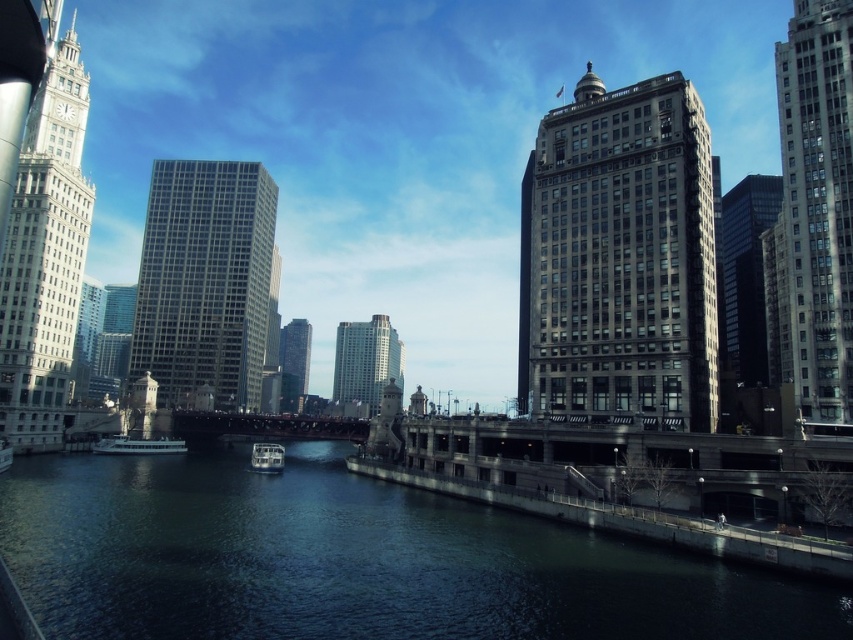
Based on the scene description, where is the white glass skyscraper at left located in the image?

The white glass skyscraper at left is located at point 0.402 on the x axis and 0.053 on the y axis.

You are a photographer standing on the bridge and want to capture both the smooth glass skyscraper at center and the white glossy boat at center in a single shot. Based on their positions, which object should you frame first to ensure both are included in the photo?

The smooth glass skyscraper at center is to the left of the white glossy boat at center, so you should frame the smooth glass skyscraper at center first to ensure both are included in the photo.

You are a city planner reviewing this urban layout. You need to determine which structure occupies more space in the cityscape. Which building is bigger between the dark gray stone building at center and the gray stone skyscraper at right?

The dark gray stone building at center is larger in size compared to the gray stone skyscraper at right, so it occupies more space in the cityscape.